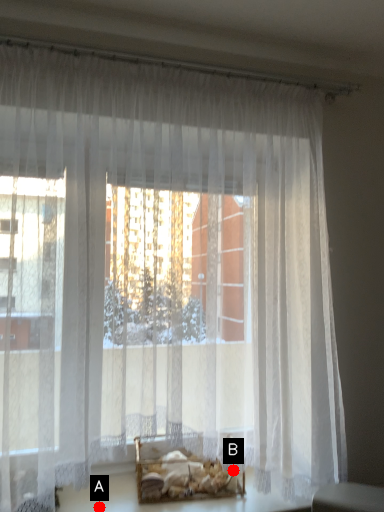
Question: Two points are circled on the image, labeled by A and B beside each circle. Among these points, which one is farthest from the camera?

Choices:
 (A) A is further
 (B) B is further

Answer: (B)